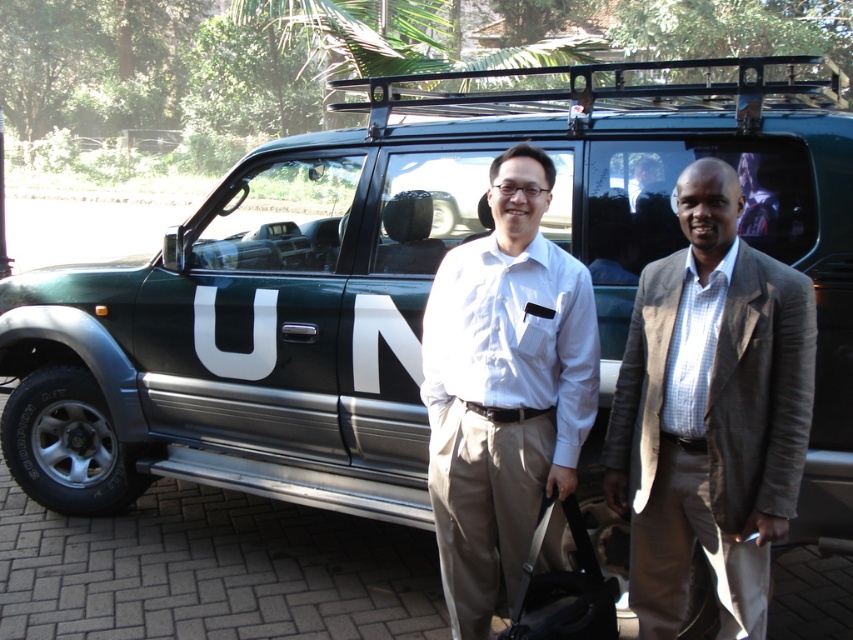
Question: Which of the following is the closest to the observer?

Choices:
 (A) gray wool blazer at right
 (B) black leather suitcase at center

Answer: (A)

Question: Which point is closer to the camera?

Choices:
 (A) black leather suitcase at center
 (B) gray wool blazer at right
 (C) green matte un vehicle at center

Answer: (B)

Question: Is gray wool blazer at right closer to the viewer compared to green matte un vehicle at center?

Choices:
 (A) yes
 (B) no

Answer: (A)

Question: Can you confirm if gray wool blazer at right is bigger than green matte un vehicle at center?

Choices:
 (A) yes
 (B) no

Answer: (B)

Question: Observing the image, what is the correct spatial positioning of gray wool blazer at right in reference to green matte un vehicle at center?

Choices:
 (A) above
 (B) below

Answer: (B)

Question: Which of the following is the closest to the observer?

Choices:
 (A) black leather suitcase at center
 (B) green matte un vehicle at center

Answer: (A)